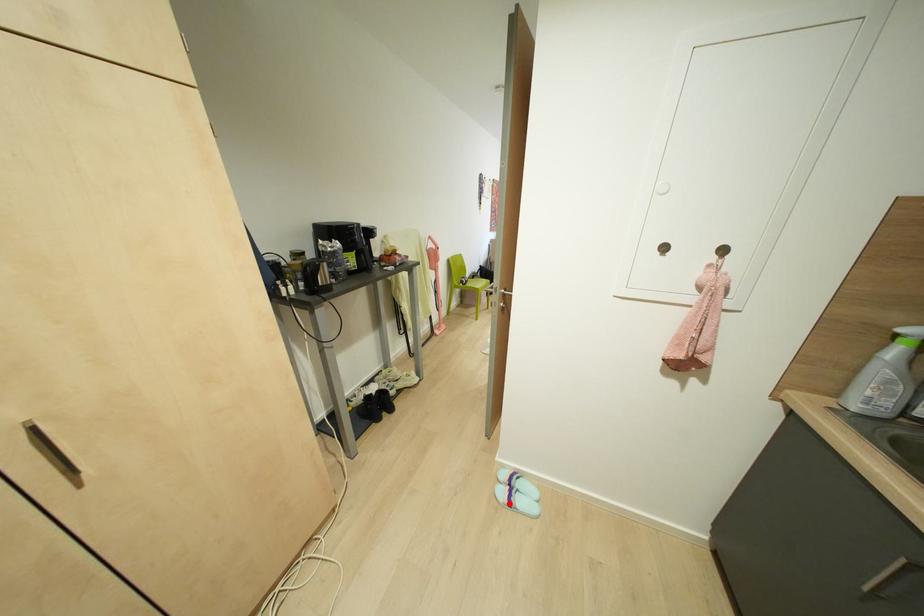
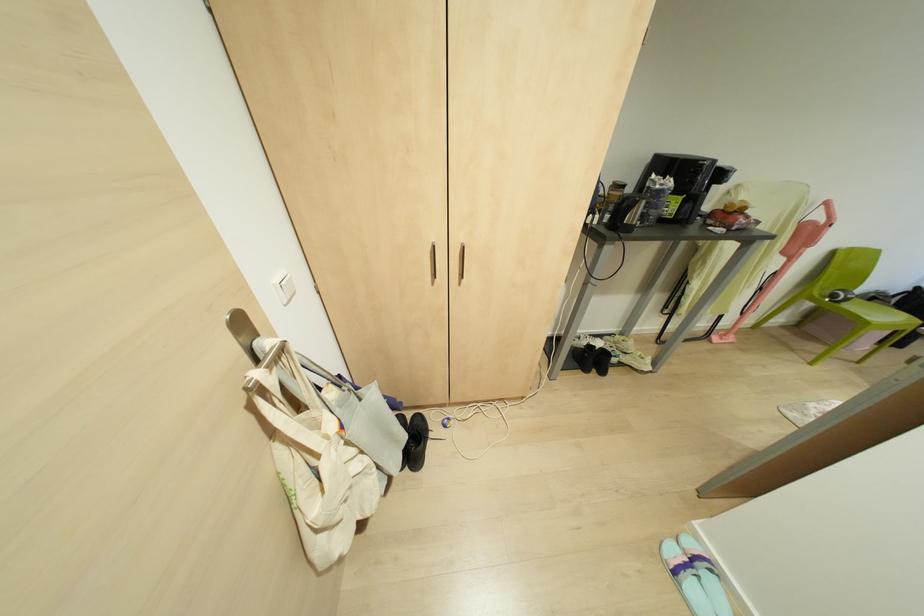
Question: A red point is marked in image1. In image2, is the corresponding 3D point closer to the camera or farther? Reply with the corresponding letter.

Choices:
 (A) The corresponding 3D point is closer.
 (B) The corresponding 3D point is farther.

Answer: (A)